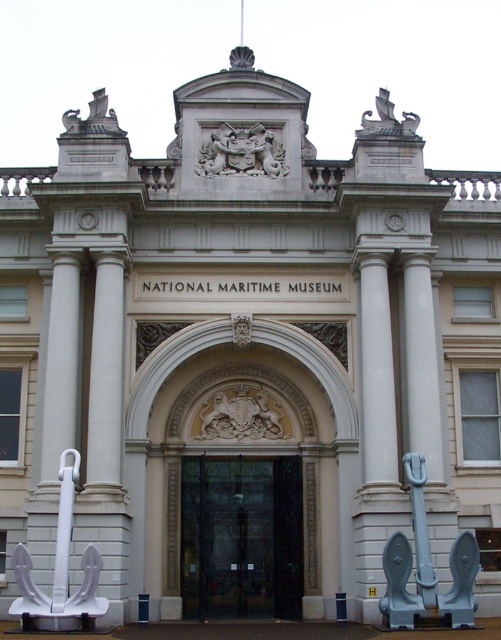
Which is more to the right, black glass door at center or white matte anchor at lower left?

Positioned to the right is black glass door at center.

Is black glass door at center above white matte anchor at lower left?

No.

Is point (246, 467) closer to viewer compared to point (59, 552)?

No, (246, 467) is further to viewer.

In order to click on black glass door at center in this screenshot , I will do `click(241, 538)`.

Does black glass door at center appear under light blue metallic anchor at right?

Indeed, black glass door at center is positioned under light blue metallic anchor at right.

Which is in front, point (262, 460) or point (409, 476)?

Positioned in front is point (409, 476).

Does point (190, 547) come closer to viewer compared to point (381, 624)?

No, it is not.

Where is `black glass door at center`? black glass door at center is located at coordinates (241, 538).

Between point (404, 588) and point (68, 124), which one is positioned in front?

Positioned in front is point (404, 588).

At what (x,y) coordinates should I click in order to perform the action: click on light blue metallic anchor at right. Please return your answer as a coordinate pair (x, y). Looking at the image, I should click on (426, 568).